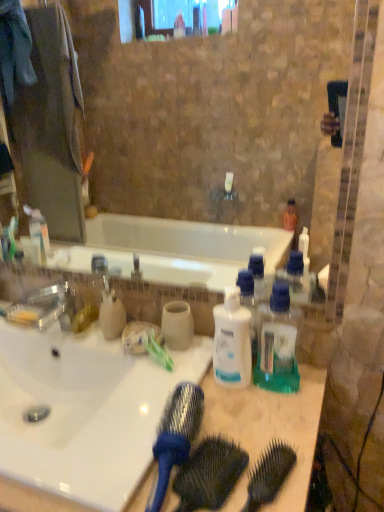
Question: In terms of width, does white plastic bottle at center, the 2th bottle from the right, look wider or thinner when compared to matte beige soap dispenser at center-left?

Choices:
 (A) thin
 (B) wide

Answer: (A)

Question: From a real-world perspective, is white plastic bottle at center, which is the 1th bottle in left-to-right order, physically located above or below matte beige soap dispenser at center-left?

Choices:
 (A) below
 (B) above

Answer: (B)

Question: Which object is the closest to the blue plastic brush at center, which appears as the 1th brush when viewed from the left?

Choices:
 (A) matte beige soap dispenser at center-left
 (B) green plastic toothbrush at center
 (C) blue plastic comb at center
 (D) translucent green plastic at center, which appears as the 2th bottle when viewed from the left
 (E) white glossy sink at center

Answer: (C)

Question: Which object is the closest to the blue plastic comb at center?

Choices:
 (A) white plastic bottle at center, which is the 1th bottle in left-to-right order
 (B) translucent green plastic at center, which appears as the 2th bottle when viewed from the left
 (C) black plastic brush at center, acting as the 1th brush starting from the right
 (D) blue plastic brush at center, which is the 2th brush in right-to-left order
 (E) matte beige soap dispenser at center-left

Answer: (D)